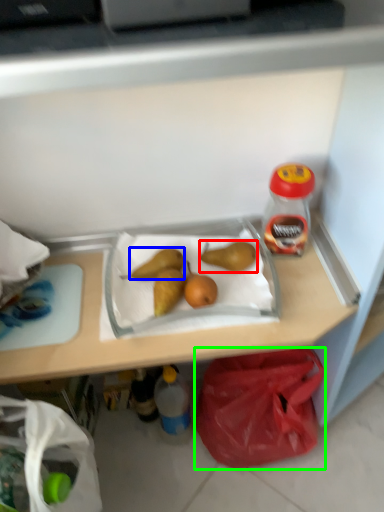
Question: Based on their relative distances, which object is nearer to pear (highlighted by a red box)? Choose from pear (highlighted by a blue box) and plastic bag (highlighted by a green box).

Choices:
 (A) pear
 (B) plastic bag

Answer: (A)